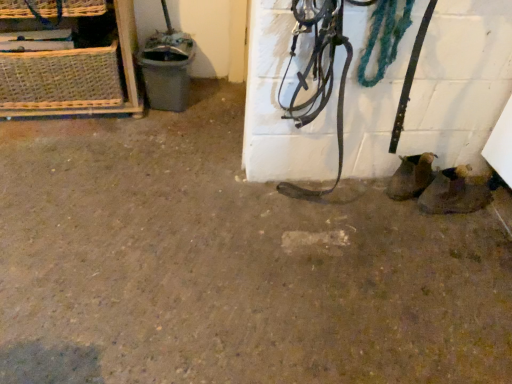
Question: In terms of height, does woven straw basket at upper left look taller or shorter compared to brown leather boots at lower right?

Choices:
 (A) short
 (B) tall

Answer: (B)

Question: Is woven straw basket at upper left to the left or to the right of brown leather boots at lower right in the image?

Choices:
 (A) left
 (B) right

Answer: (A)

Question: From a real-world perspective, is woven straw basket at upper left physically located above or below brown leather boots at lower right?

Choices:
 (A) below
 (B) above

Answer: (B)

Question: Is point (452, 177) positioned closer to the camera than point (12, 61)?

Choices:
 (A) closer
 (B) farther

Answer: (A)

Question: Choose the correct answer: Is brown leather boots at lower right inside woven straw basket at upper left or outside it?

Choices:
 (A) inside
 (B) outside

Answer: (B)

Question: From a real-world perspective, is brown leather boots at lower right positioned above or below woven straw basket at upper left?

Choices:
 (A) below
 (B) above

Answer: (A)

Question: In terms of size, does brown leather boots at lower right appear bigger or smaller than woven straw basket at upper left?

Choices:
 (A) big
 (B) small

Answer: (B)